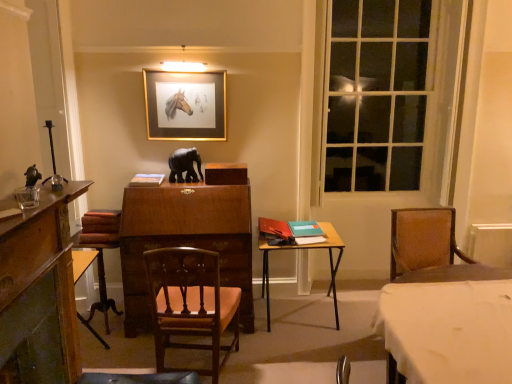
You are a GUI agent. You are given a task and a screenshot of the screen. Output one action in this format:
    pyautogui.click(x=<x>, y=<y>)
    Task: Click on the free location above gold-framed picture at upper center (from a real-world perspective)
    
    Given the screenshot: What is the action you would take?
    pyautogui.click(x=183, y=68)